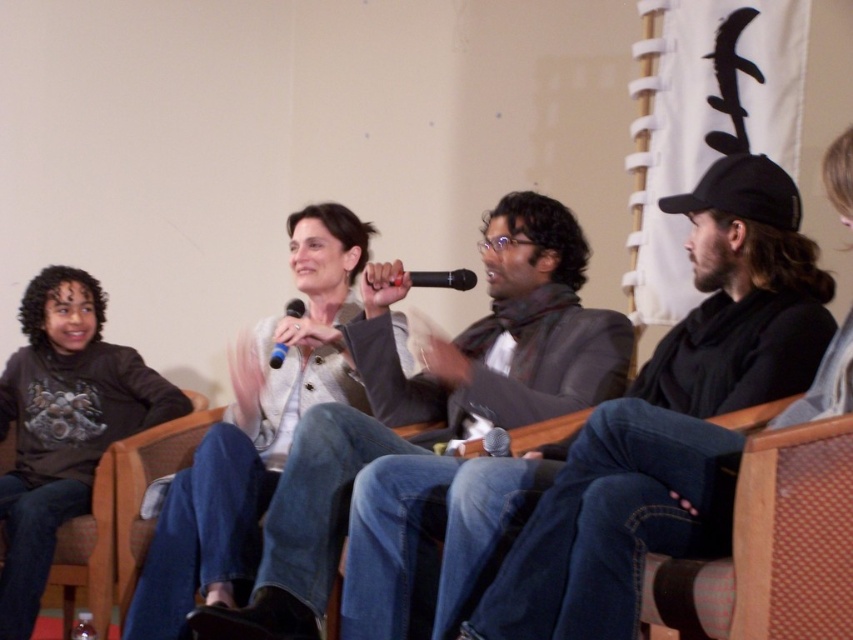
You are an event organizer who needs to ensure the microphone is visible to the audience. Based on the scene, is the black matte microphone at center obscured by the dark gray sweater at center?

The dark gray sweater at center is in front of the black matte microphone at center, so yes, the microphone is obscured by the sweater.

You are attending the event and want to describe the speaker holding the microphone. Which object is positioned lower on her body, the dark gray sweater at center or the black matte microphone at center?

The dark gray sweater at center is located below the black matte microphone at center, so the sweater is positioned lower on her body.